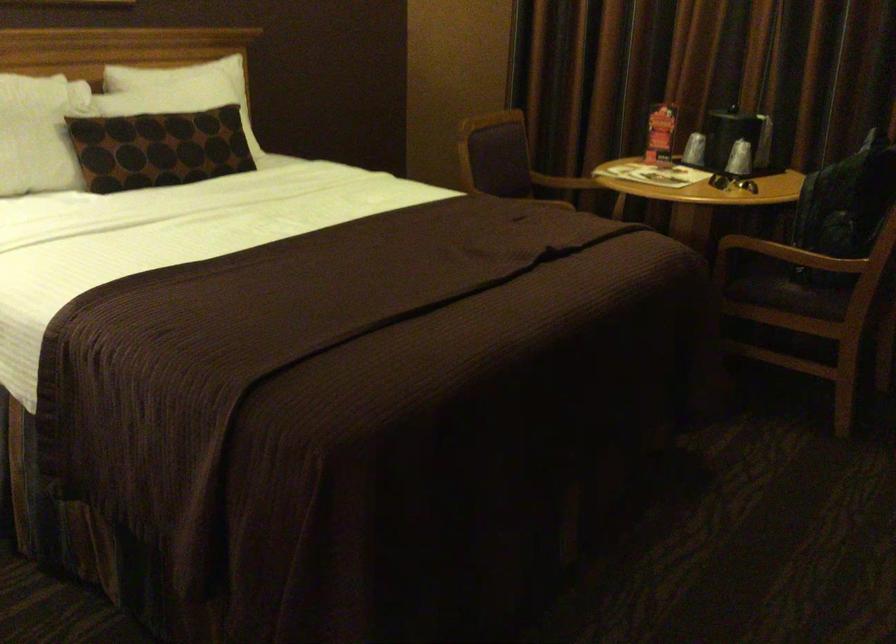
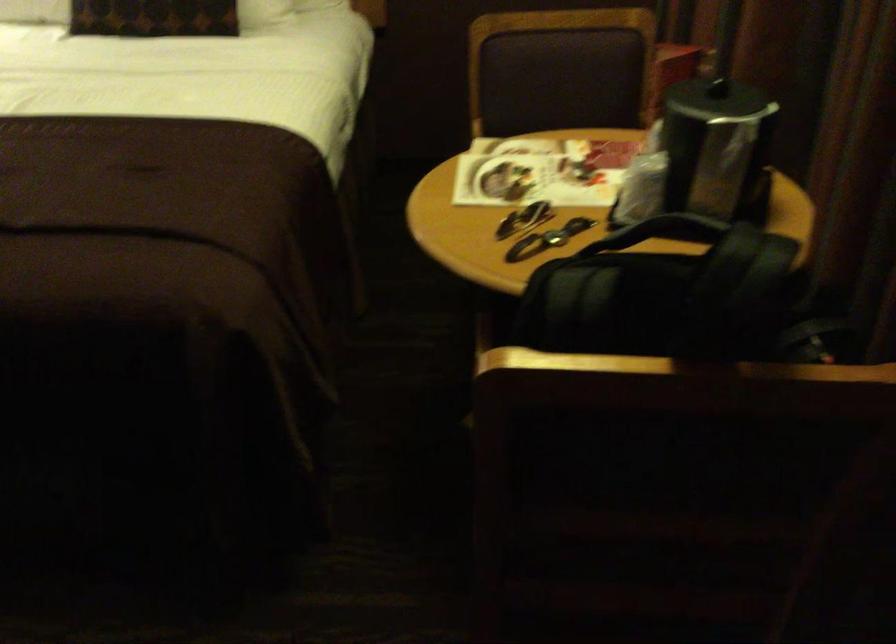
In the second image, find the point that corresponds to the point at 763,128 in the first image.

(717, 149)